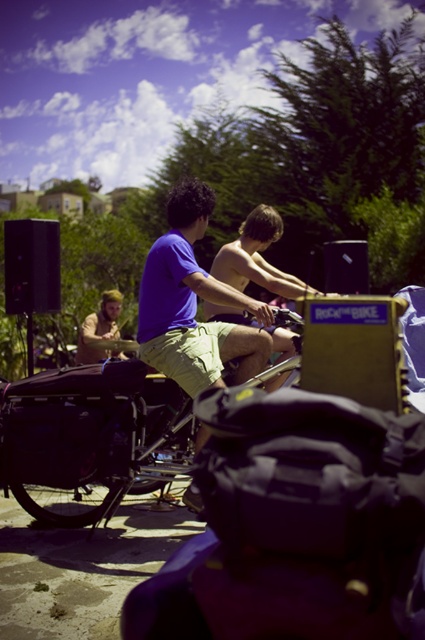
Is point (226, 269) farther from camera compared to point (102, 304)?

No, it is not.

The width and height of the screenshot is (425, 640). What are the coordinates of `smooth skin boy at center` in the screenshot? It's located at (255, 257).

Who is taller, matte black bicycle at center or purple cotton shirt at center?

purple cotton shirt at center

Between matte black bicycle at center and purple cotton shirt at center, which one has less height?

With less height is matte black bicycle at center.

Is point (70, 476) more distant than point (204, 432)?

No, (70, 476) is in front of (204, 432).

Where is `matte black bicycle at center`? The height and width of the screenshot is (640, 425). matte black bicycle at center is located at coordinates click(90, 438).

Is matte black bicycle at center closer to the viewer compared to light brown hair at center?

Yes, matte black bicycle at center is closer to the viewer.

Does matte black bicycle at center have a smaller size compared to light brown hair at center?

Actually, matte black bicycle at center might be larger than light brown hair at center.

The width and height of the screenshot is (425, 640). What do you see at coordinates (90, 438) in the screenshot? I see `matte black bicycle at center` at bounding box center [90, 438].

The height and width of the screenshot is (640, 425). What are the coordinates of `matte black bicycle at center` in the screenshot? It's located at (90, 438).